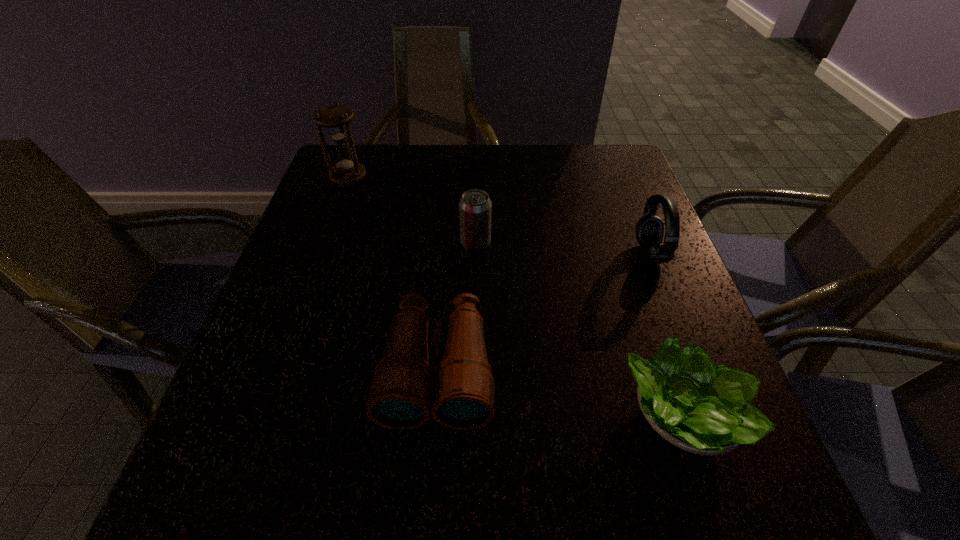
I want to click on free location that satisfies the following two spatial constraints: 1. on the earcups of the headset; 2. through the lenses of the binoculars, so click(695, 370).

Where is `free spot that satisfies the following two spatial constraints: 1. through the lenses of the lettuce; 2. on the left side of the binoculars`? The image size is (960, 540). free spot that satisfies the following two spatial constraints: 1. through the lenses of the lettuce; 2. on the left side of the binoculars is located at coordinates (434, 416).

The height and width of the screenshot is (540, 960). In order to click on vacant space that satisfies the following two spatial constraints: 1. on the earcups of the headset; 2. on the front side of the lettuce in this screenshot , I will do `click(712, 416)`.